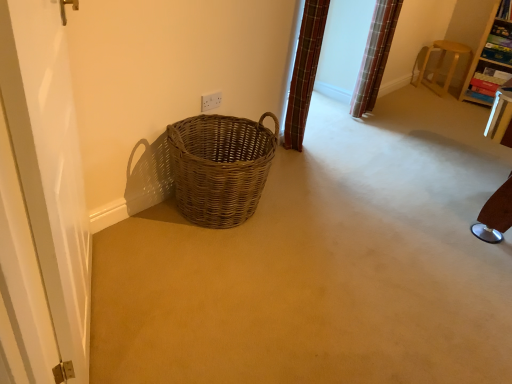
Where is `free space that is in between plaid fabric curtain at upper right, the second curtain in the front-to-back sequence, and woven brown basket at center`? free space that is in between plaid fabric curtain at upper right, the second curtain in the front-to-back sequence, and woven brown basket at center is located at coordinates (317, 145).